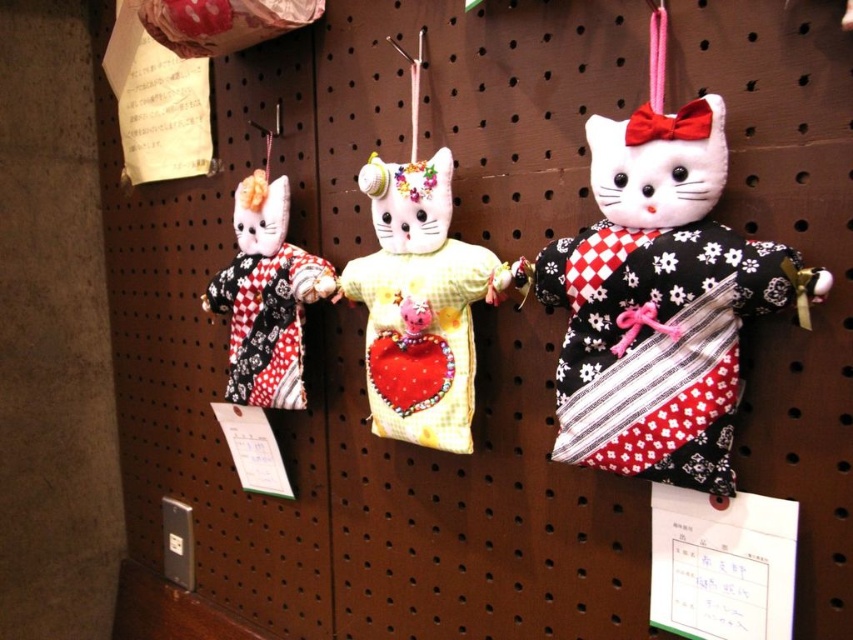
You are organizing a display and need to know the height of the objects. Which is taller between the matte black kimono at right and the matte black and white kimono cat at left?

The matte black kimono at right is taller than the matte black and white kimono cat at left.

You are organizing a display of the two cats on the pegboard wall. The yellow fabric cat at center needs to be moved to a position above the matte black and white kimono cat at left. Is this possible without removing either cat from the wall?

The yellow fabric cat at center is currently located below the matte black and white kimono cat at left. To move it above, you would need to adjust their positions on the pegboard. Since the pegboard allows for hanging items at different heights, it is possible to reposition the yellow fabric cat at center above the matte black and white kimono cat at left by attaching it to higher pegs.

What is the 2D coordinate of the yellow fabric cat at center?

The yellow fabric cat at center is located at the 2D coordinate point of (419, 305).